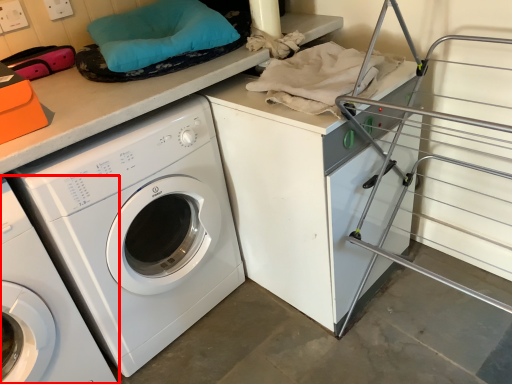
Question: From the image's perspective, considering the relative positions of washing machine (annotated by the red box) and washing machine in the image provided, where is washing machine (annotated by the red box) located with respect to the staircase?

Choices:
 (A) above
 (B) below

Answer: (B)